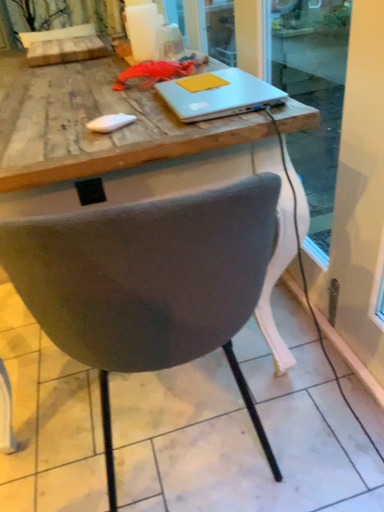
What is the approximate width of sleek white laptop at center?

It is 9.12 inches.

What do you see at coordinates (201, 82) in the screenshot?
I see `yellow matte notepad at upper center` at bounding box center [201, 82].

The image size is (384, 512). Identify the location of gray fabric chair at center. (149, 283).

Measure the distance from gray fabric chair at center to white textured curtain at upper left.

gray fabric chair at center and white textured curtain at upper left are 1.92 meters apart.

From the image's perspective, is gray fabric chair at center located above or below white textured curtain at upper left?

Based on their image positions, gray fabric chair at center is located beneath white textured curtain at upper left.

Does gray fabric chair at center lie behind white textured curtain at upper left?

No, the depth of gray fabric chair at center is less than that of white textured curtain at upper left.

From the picture: Can you confirm if gray fabric chair at center is bigger than white textured curtain at upper left?

Yes, gray fabric chair at center is bigger than white textured curtain at upper left.

Where is `curtain above the sleek white laptop at center (from a real-world perspective)`? curtain above the sleek white laptop at center (from a real-world perspective) is located at coordinates (77, 15).

Is sleek white laptop at center facing towards white textured curtain at upper left?

No, sleek white laptop at center is not oriented towards white textured curtain at upper left.

From the image's perspective, which one is positioned higher, sleek white laptop at center or white textured curtain at upper left?

From the image's view, white textured curtain at upper left is above.

Considering the sizes of objects sleek white laptop at center and white textured curtain at upper left in the image provided, who is shorter, sleek white laptop at center or white textured curtain at upper left?

sleek white laptop at center.

From the image's perspective, between sleek white laptop at center and gray fabric chair at center, which one is located above?

From the image's view, sleek white laptop at center is above.

Does sleek white laptop at center appear on the right side of gray fabric chair at center?

Correct, you'll find sleek white laptop at center to the right of gray fabric chair at center.

Is sleek white laptop at center turned away from gray fabric chair at center?

Yes, sleek white laptop at center is facing away from gray fabric chair at center.

Where is `chair below the sleek white laptop at center (from a real-world perspective)`? chair below the sleek white laptop at center (from a real-world perspective) is located at coordinates (x=149, y=283).

Considering the points (91, 12) and (215, 83), which point is behind, point (91, 12) or point (215, 83)?

The point (91, 12) is more distant.

Is white textured curtain at upper left with yellow matte notepad at upper center?

No, white textured curtain at upper left is not in contact with yellow matte notepad at upper center.

Relative to yellow matte notepad at upper center, is white textured curtain at upper left in front or behind?

Visually, white textured curtain at upper left is located behind yellow matte notepad at upper center.

From the image's perspective, is white textured curtain at upper left above or below yellow matte notepad at upper center?

From the image's perspective, white textured curtain at upper left appears above yellow matte notepad at upper center.

From a real-world perspective, does white textured curtain at upper left sit lower than gray fabric chair at center?

Incorrect, from a real-world perspective, white textured curtain at upper left is higher than gray fabric chair at center.

Between white textured curtain at upper left and gray fabric chair at center, which one is positioned in front?

gray fabric chair at center is closer to the camera.

Considering the relative positions of white textured curtain at upper left and gray fabric chair at center in the image provided, is white textured curtain at upper left to the right of gray fabric chair at center from the viewer's perspective?

No, white textured curtain at upper left is not to the right of gray fabric chair at center.

Does white textured curtain at upper left have a greater height compared to gray fabric chair at center?

Incorrect, the height of white textured curtain at upper left is not larger of that of gray fabric chair at center.

Is yellow matte notepad at upper center at the right side of sleek white laptop at center?

Incorrect, yellow matte notepad at upper center is not on the right side of sleek white laptop at center.

From a real-world perspective, between yellow matte notepad at upper center and sleek white laptop at center, who is vertically lower?

In real-world perspective, sleek white laptop at center is lower.

Is yellow matte notepad at upper center completely or partially outside of sleek white laptop at center?

No.

Based on the photo, between yellow matte notepad at upper center and sleek white laptop at center, which one has smaller width?

yellow matte notepad at upper center is thinner.

In the scene shown: From a real-world perspective, is yellow matte notepad at upper center physically above gray fabric chair at center?

Correct, in the physical world, yellow matte notepad at upper center is higher than gray fabric chair at center.

Considering the positions of points (204, 86) and (238, 379), is point (204, 86) closer to camera compared to point (238, 379)?

That is True.

Between yellow matte notepad at upper center and gray fabric chair at center, which one has larger size?

With larger size is gray fabric chair at center.

Based on the photo, can you tell me how much yellow matte notepad at upper center and gray fabric chair at center differ in facing direction?

92.4 degrees separate the facing orientations of yellow matte notepad at upper center and gray fabric chair at center.

Find the location of a particular element. This screenshot has width=384, height=512. curtain above the gray fabric chair at center (from the image's perspective) is located at coordinates (77, 15).

I want to click on laptop directly beneath the white textured curtain at upper left (from a real-world perspective), so click(x=218, y=96).

From the image, which object appears to be nearer to sleek white laptop at center, gray fabric chair at center or yellow matte notepad at upper center?

Based on the image, yellow matte notepad at upper center appears to be nearer to sleek white laptop at center.

Based on the photo, which object lies nearer to the anchor point sleek white laptop at center, yellow matte notepad at upper center or gray fabric chair at center?

yellow matte notepad at upper center is closer to sleek white laptop at center.

When comparing their distances from sleek white laptop at center, does yellow matte notepad at upper center or white textured curtain at upper left seem closer?

yellow matte notepad at upper center is positioned closer to the anchor sleek white laptop at center.

Estimate the real-world distances between objects in this image. Which object is further from sleek white laptop at center, white textured curtain at upper left or yellow matte notepad at upper center?

Based on the image, white textured curtain at upper left appears to be further to sleek white laptop at center.

Considering their positions, is white textured curtain at upper left positioned closer to sleek white laptop at center than gray fabric chair at center?

Among the two, gray fabric chair at center is located nearer to sleek white laptop at center.

Based on their spatial positions, is sleek white laptop at center or yellow matte notepad at upper center closer to white textured curtain at upper left?

Based on the image, sleek white laptop at center appears to be nearer to white textured curtain at upper left.

Considering their positions, is gray fabric chair at center positioned closer to sleek white laptop at center than white textured curtain at upper left?

gray fabric chair at center lies closer to sleek white laptop at center than the other object.

When comparing their distances from yellow matte notepad at upper center, does gray fabric chair at center or white textured curtain at upper left seem further?

Based on the image, white textured curtain at upper left appears to be further to yellow matte notepad at upper center.

The width and height of the screenshot is (384, 512). I want to click on notepad positioned between sleek white laptop at center and white textured curtain at upper left from near to far, so click(x=201, y=82).

The image size is (384, 512). In order to click on notepad between gray fabric chair at center and white textured curtain at upper left in the front-back direction in this screenshot , I will do `click(201, 82)`.

Identify the location of laptop that lies between yellow matte notepad at upper center and gray fabric chair at center from top to bottom. (218, 96).

Identify the location of laptop positioned between gray fabric chair at center and white textured curtain at upper left from near to far. (218, 96).